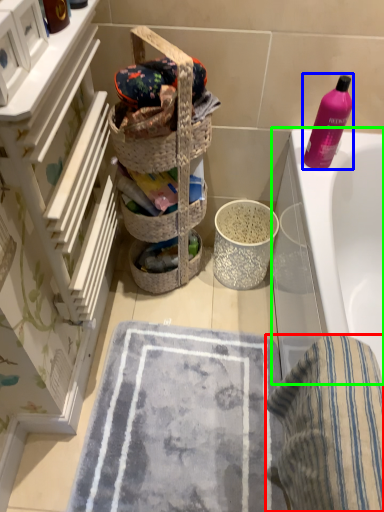
Question: Which is nearer to the beach towel (highlighted by a red box)? cleaning product (highlighted by a blue box) or bathtub (highlighted by a green box).

Choices:
 (A) cleaning product
 (B) bathtub

Answer: (B)